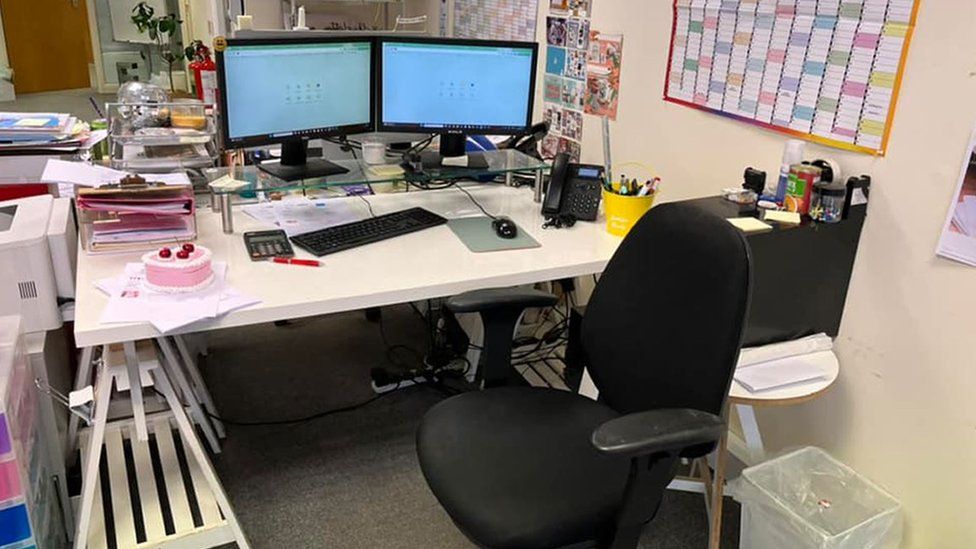
This screenshot has width=976, height=549. What are the coordinates of `arm rest` in the screenshot? It's located at (543, 472).